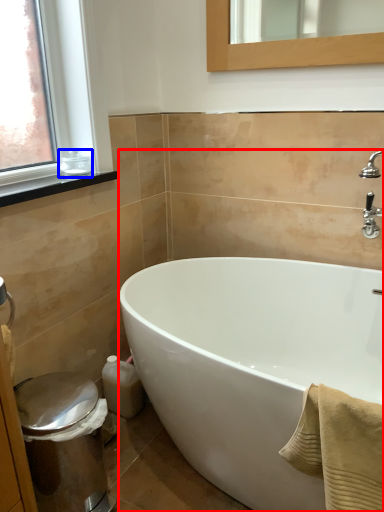
Question: Which object appears closest to the camera in this image, bathtub (highlighted by a red box) or toiletry (highlighted by a blue box)?

Choices:
 (A) bathtub
 (B) toiletry

Answer: (A)